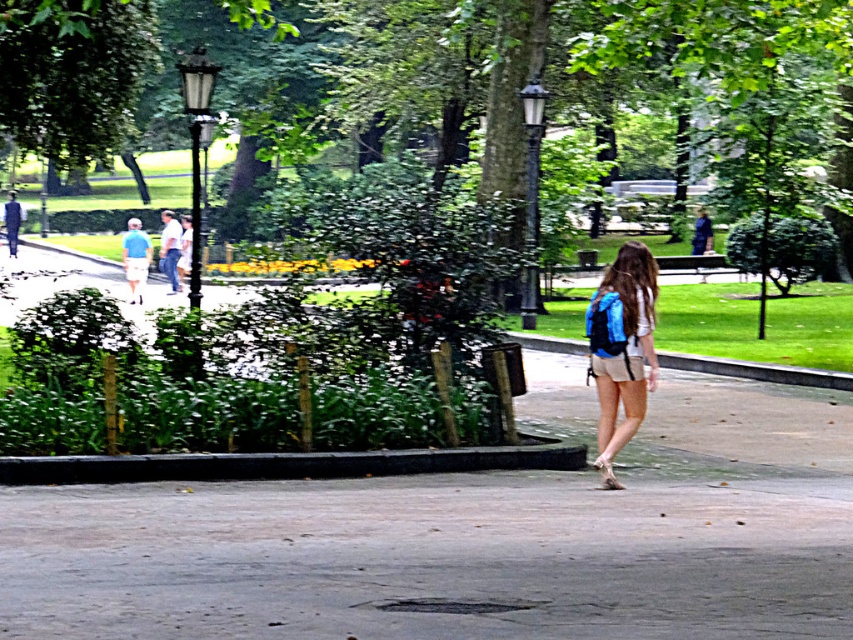
Question: Which object appears closest to the camera in this image?

Choices:
 (A) gray concrete pavement at center
 (B) blue fabric backpack at center

Answer: (A)

Question: Does gray concrete pavement at center have a greater width compared to blue fabric backpack at center?

Choices:
 (A) no
 (B) yes

Answer: (B)

Question: Can you confirm if gray concrete pavement at center is positioned to the left of blue fabric backpack at center?

Choices:
 (A) yes
 (B) no

Answer: (A)

Question: Does gray concrete pavement at center have a smaller size compared to blue fabric backpack at center?

Choices:
 (A) no
 (B) yes

Answer: (B)

Question: Which point is closer to the camera?

Choices:
 (A) (285, 547)
 (B) (606, 403)

Answer: (A)